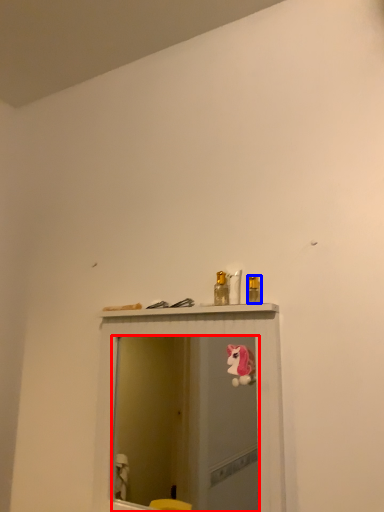
Question: Which object is further to the camera taking this photo, mirror (highlighted by a red box) or toiletry (highlighted by a blue box)?

Choices:
 (A) mirror
 (B) toiletry

Answer: (B)